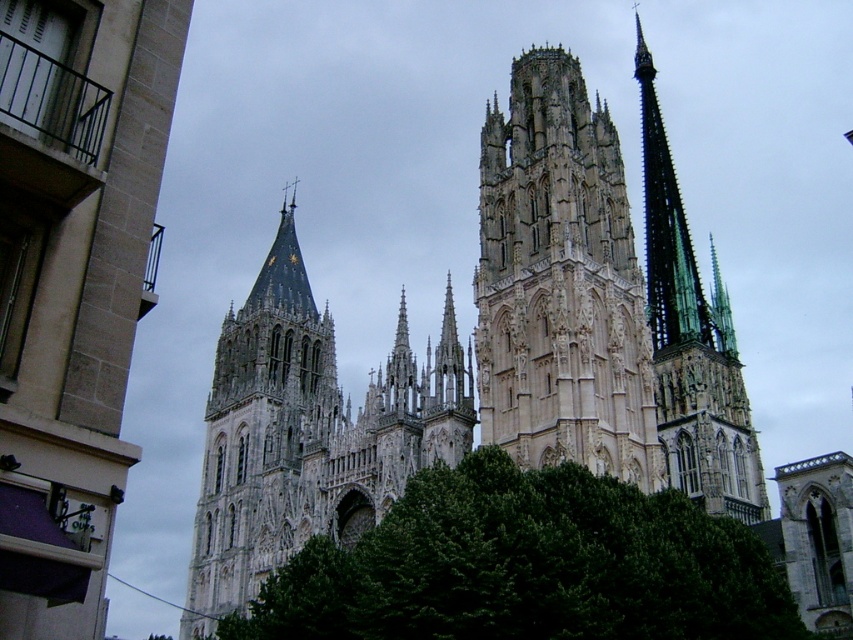
Can you confirm if white stone church at center is shorter than white stone tower at center?

Yes, white stone church at center is shorter than white stone tower at center.

Is point (74, 445) more distant than point (630, 378)?

No.

I want to click on white stone church at center, so click(73, 285).

Between point (589, 412) and point (711, 340), which one is positioned in front?

Point (589, 412) is more forward.

Can you confirm if white stone tower at center is bigger than green copper spire at upper right?

No, white stone tower at center is not bigger than green copper spire at upper right.

Find the location of `white stone tower at center`. white stone tower at center is located at coordinates (560, 284).

Can you confirm if white stone church at center is taller than white stone tower at left?

No, white stone church at center is not taller than white stone tower at left.

Is the position of white stone church at center less distant than that of white stone tower at left?

Yes, it is.

Is point (56, 225) positioned in front of point (235, 538)?

Yes, point (56, 225) is closer to viewer.

Locate an element on the screen. This screenshot has width=853, height=640. white stone church at center is located at coordinates point(73,285).